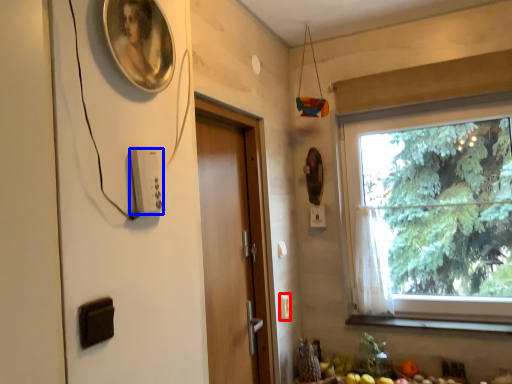
Question: Which object appears farthest to the camera in this image, light switch (highlighted by a red box) or light switch (highlighted by a blue box)?

Choices:
 (A) light switch
 (B) light switch

Answer: (A)